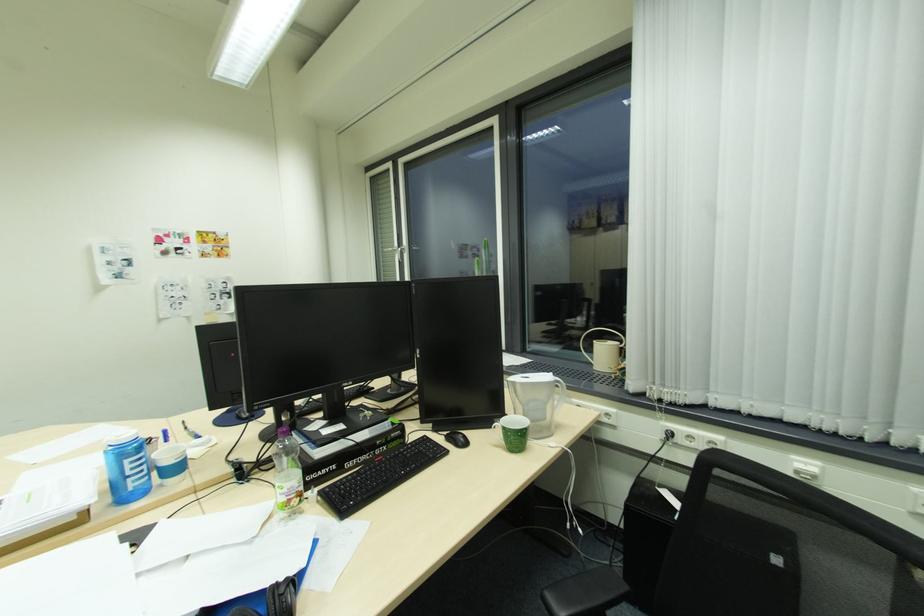
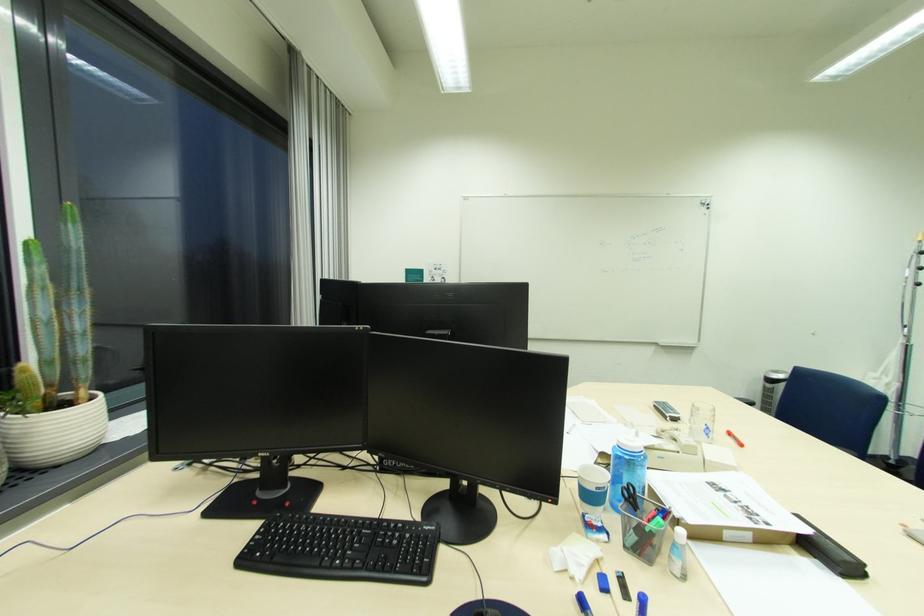
In the second image, find the point that corresponds to point (492, 249) in the first image.

(79, 225)